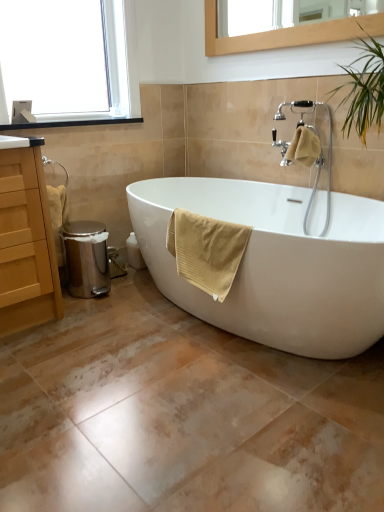
Question: From the image's perspective, is clear glass window at upper left above yellow textured towel at upper right, acting as the first bath towel starting from the right?

Choices:
 (A) yes
 (B) no

Answer: (A)

Question: Is yellow textured towel at upper right, which is the first bath towel from back to front, at the back of clear glass window at upper left?

Choices:
 (A) yes
 (B) no

Answer: (B)

Question: Considering the relative sizes of clear glass window at upper left and yellow textured towel at upper right, acting as the first bath towel starting from the right, in the image provided, is clear glass window at upper left wider than yellow textured towel at upper right, acting as the first bath towel starting from the right,?

Choices:
 (A) no
 (B) yes

Answer: (B)

Question: Is clear glass window at upper left beside yellow textured towel at upper right, acting as the 2th bath towel starting from the front?

Choices:
 (A) no
 (B) yes

Answer: (A)

Question: From the image's perspective, is clear glass window at upper left under yellow textured towel at upper right, arranged as the first bath towel when viewed from the top?

Choices:
 (A) no
 (B) yes

Answer: (A)

Question: Is clear glass window at upper left facing towards yellow textured towel at upper right, acting as the first bath towel starting from the right?

Choices:
 (A) yes
 (B) no

Answer: (A)

Question: Is clear glass window at upper left with matte wood cabinet at left?

Choices:
 (A) no
 (B) yes

Answer: (A)

Question: Does clear glass window at upper left lie behind matte wood cabinet at left?

Choices:
 (A) no
 (B) yes

Answer: (B)

Question: Considering the relative positions of clear glass window at upper left and matte wood cabinet at left in the image provided, is clear glass window at upper left to the left of matte wood cabinet at left from the viewer's perspective?

Choices:
 (A) no
 (B) yes

Answer: (A)

Question: Does clear glass window at upper left have a greater width compared to matte wood cabinet at left?

Choices:
 (A) no
 (B) yes

Answer: (A)

Question: Does clear glass window at upper left have a lesser width compared to matte wood cabinet at left?

Choices:
 (A) no
 (B) yes

Answer: (B)

Question: From the image's perspective, is clear glass window at upper left beneath matte wood cabinet at left?

Choices:
 (A) yes
 (B) no

Answer: (B)

Question: Is white glossy bathtub at center oriented towards yellow textured towel at upper right, the 2th bath towel from the left?

Choices:
 (A) yes
 (B) no

Answer: (B)